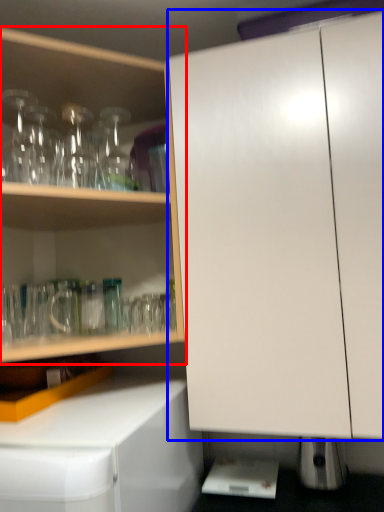
Question: Which object is closer to the camera taking this photo, cabinetry (highlighted by a red box) or cabinetry (highlighted by a blue box)?

Choices:
 (A) cabinetry
 (B) cabinetry

Answer: (B)